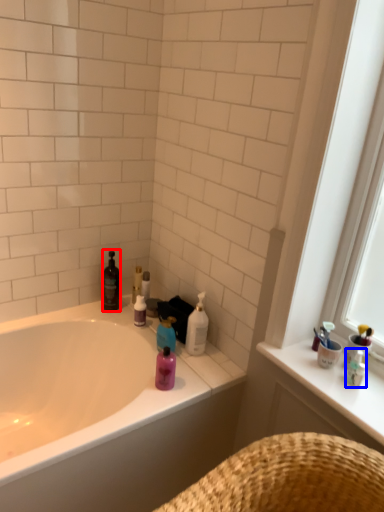
Question: Which of the following is the closest to the observer, cleaning product (highlighted by a red box) or toiletry (highlighted by a blue box)?

Choices:
 (A) cleaning product
 (B) toiletry

Answer: (B)